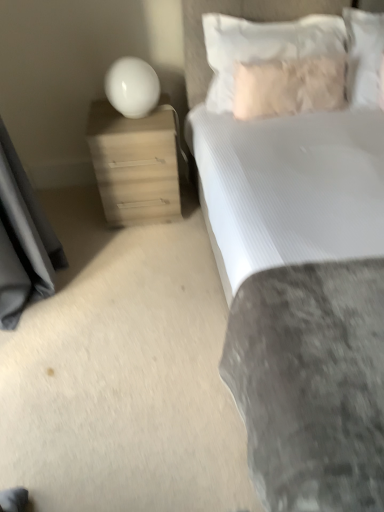
Where is `vacant space in front of matte wood nightstand at left`? Image resolution: width=384 pixels, height=512 pixels. vacant space in front of matte wood nightstand at left is located at coordinates (139, 247).